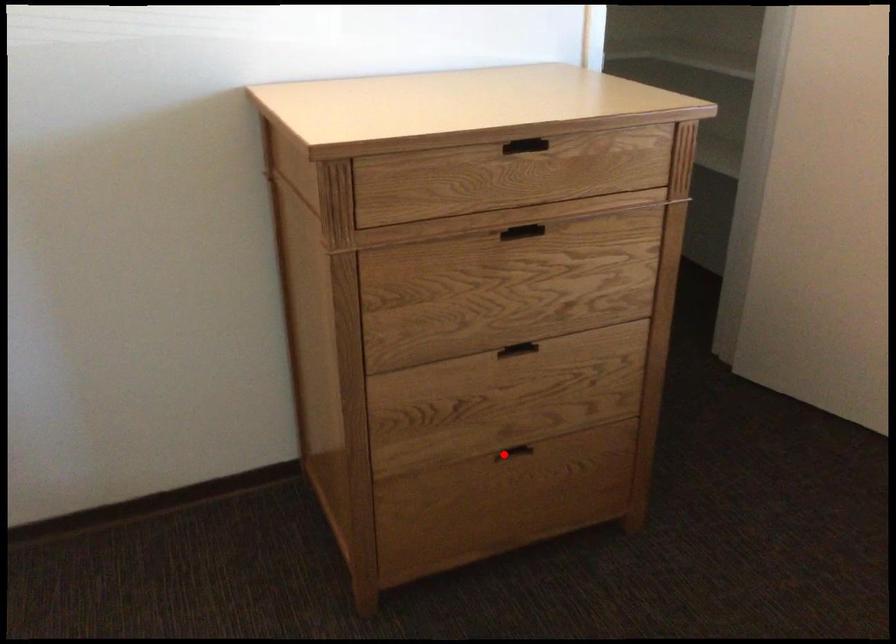
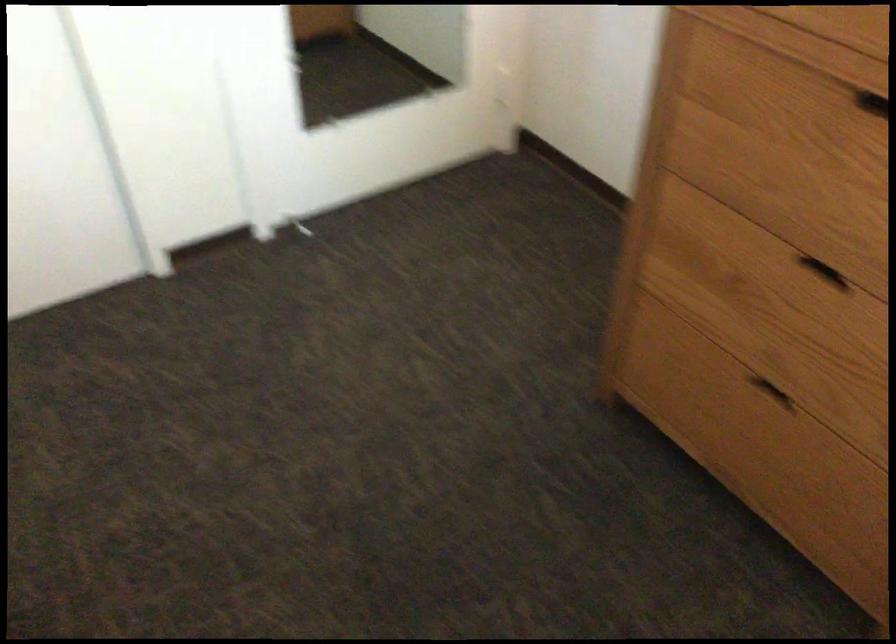
Question: I am providing you with two images of the same scene from different viewpoints. A red point is shown in image1. For the corresponding object point in image2, is it positioned nearer or farther from the camera?

Choices:
 (A) Nearer
 (B) Farther

Answer: (A)